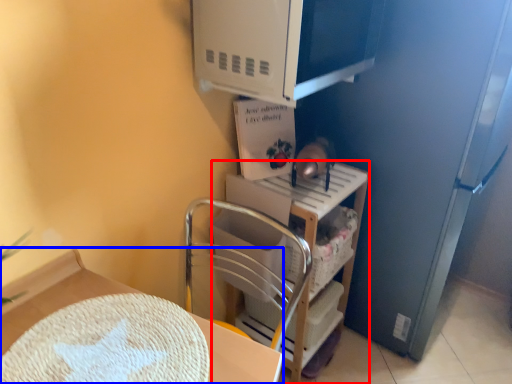
Question: Which object is closer to the camera taking this photo, shelf (highlighted by a red box) or furniture (highlighted by a blue box)?

Choices:
 (A) shelf
 (B) furniture

Answer: (B)